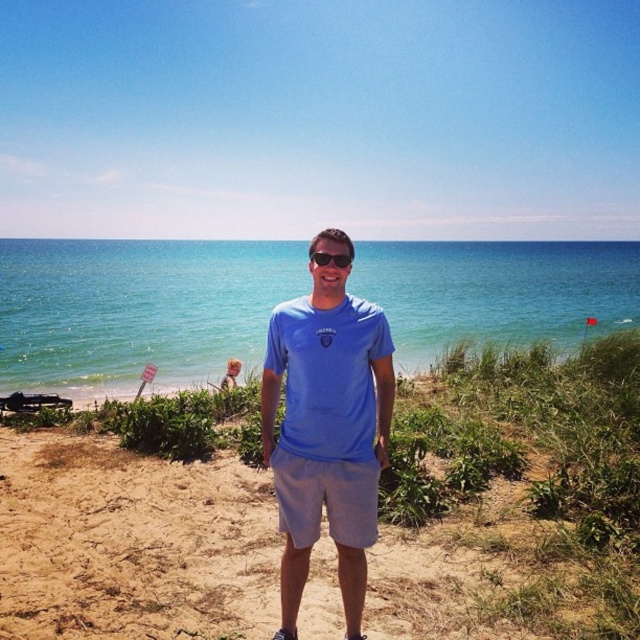
Based on the photo, you are standing at the beach and want to take a photo of both the point at coordinates point (x=339, y=433) and point (x=320, y=253). Since you want both points in the frame, which point should you position closer to the camera to ensure both are visible?

You should position yourself closer to the point at coordinates point (x=339, y=433) because it is closer to the camera than point (x=320, y=253). This way, both points will be within the camera frame.

You are a beachgoer who wants to walk from the light brown sand at center to the blue water at center. According to the scene, which direction should you move in?

The light brown sand at center is located below the blue water at center, so you should move upward to reach the blue water at center from the light brown sand at center.

In the scene shown: You are a photographer taking a picture of the beach scene. You notice the light brown sand at center and the blue fabric shirt at center. Which object is positioned lower in the image?

The light brown sand at center is positioned below the blue fabric shirt at center, so it is lower in the image.